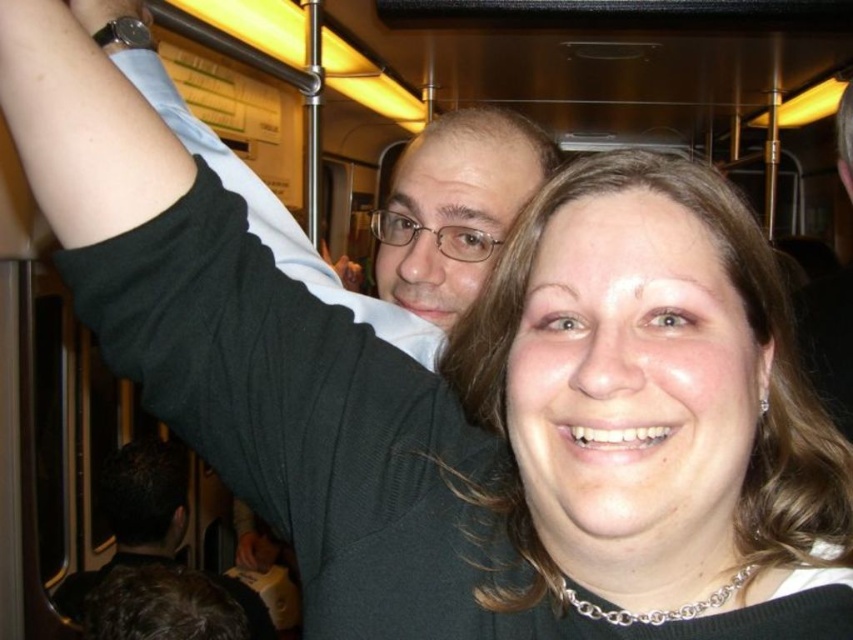
Question: Is matte black sweater at center bigger than black matte hair at upper center?

Choices:
 (A) no
 (B) yes

Answer: (A)

Question: Does matte black sweater at center lie in front of black matte hair at upper center?

Choices:
 (A) no
 (B) yes

Answer: (B)

Question: From the image, what is the correct spatial relationship of matte black sweater at center in relation to black matte hair at upper center?

Choices:
 (A) above
 (B) below

Answer: (A)